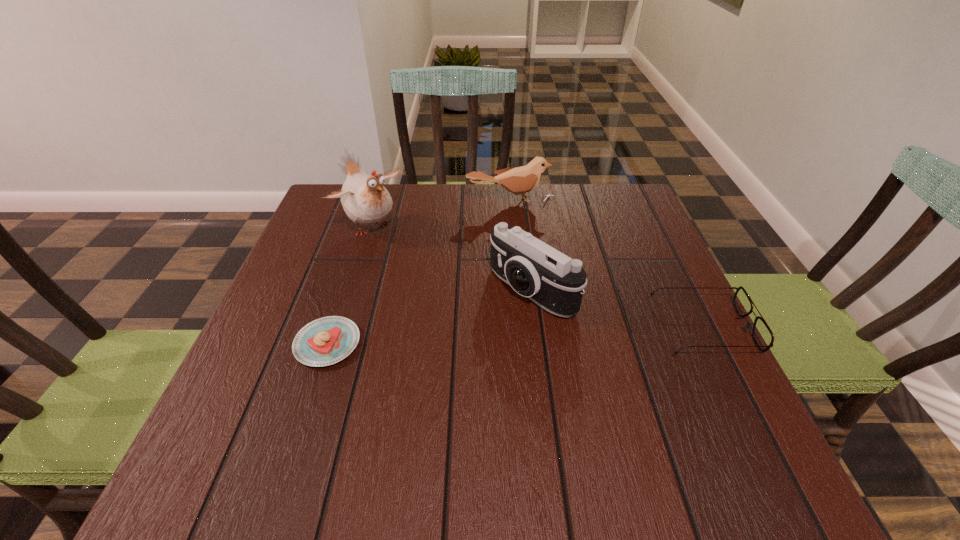
Identify the location of vacant space that satisfies the following two spatial constraints: 1. on the back side of the right bird; 2. on the left side of the left bird. This screenshot has height=540, width=960. (377, 202).

Identify the location of vacant region that satisfies the following two spatial constraints: 1. on the back side of the taller bird; 2. on the right side of the right bird. (377, 202).

Where is `free point that satisfies the following two spatial constraints: 1. on the front side of the fourth tallest object; 2. on the front-facing side of the shorter bird`? The image size is (960, 540). free point that satisfies the following two spatial constraints: 1. on the front side of the fourth tallest object; 2. on the front-facing side of the shorter bird is located at coordinates pyautogui.click(x=522, y=328).